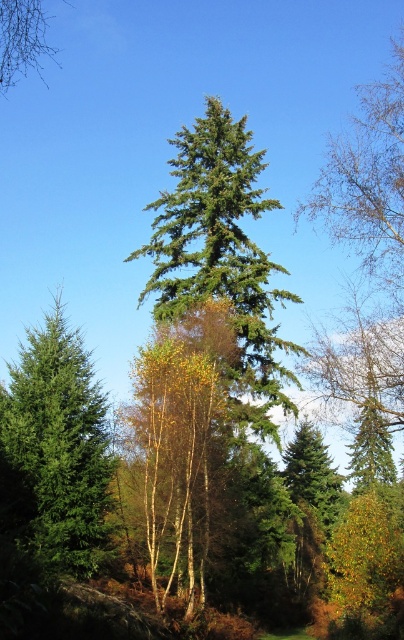
Is green matte evergreen tree at left taller than bare branches at upper left?

Incorrect, green matte evergreen tree at left's height is not larger of bare branches at upper left's.

Between green matte evergreen tree at left and bare branches at upper left, which one is positioned lower?

green matte evergreen tree at left

Based on the photo, who is more forward, (101, 483) or (23, 42)?

Point (23, 42) is more forward.

The width and height of the screenshot is (404, 640). Find the location of `green matte evergreen tree at left`. green matte evergreen tree at left is located at coordinates [61, 445].

Is green matte tree at center closer to the viewer compared to bare branches at upper left?

→ No, green matte tree at center is further to the viewer.

Which is more to the right, green matte tree at center or bare branches at upper left?

Positioned to the right is green matte tree at center.

Is point (166, 264) farther from viewer compared to point (18, 26)?

Yes.

Where is `green matte tree at center`? green matte tree at center is located at coordinates (222, 257).

Between green matte tree at center and green matte evergreen tree at left, which one is positioned lower?

green matte evergreen tree at left

Looking at this image, does green matte tree at center have a lesser width compared to green matte evergreen tree at left?

No, green matte tree at center is not thinner than green matte evergreen tree at left.

The height and width of the screenshot is (640, 404). I want to click on green matte tree at center, so click(222, 257).